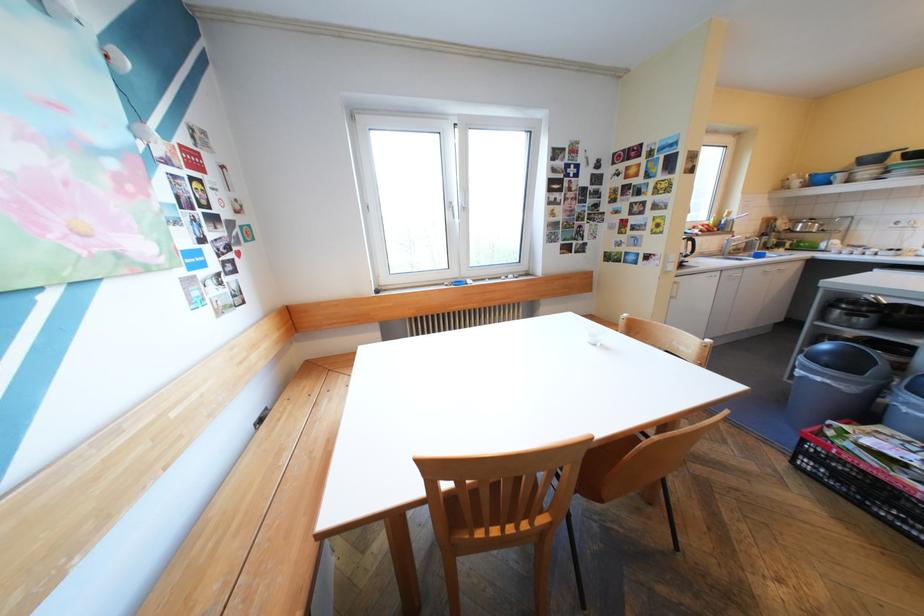
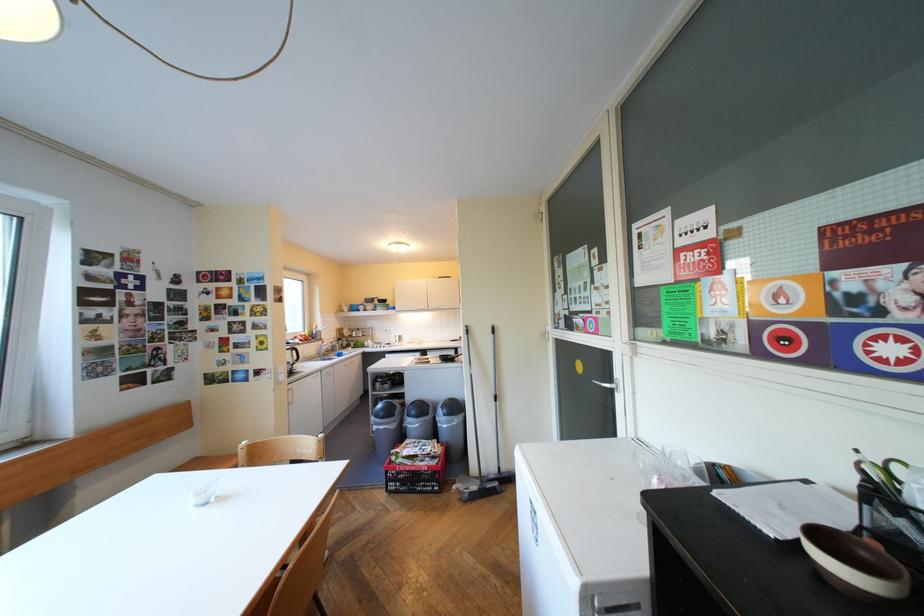
Where in the second image is the point corresponding to (x=859, y=363) from the first image?

(402, 411)